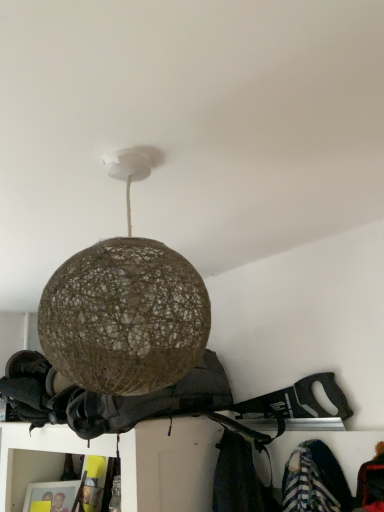
Question: Considering the positions of brown woven sphere at center and brown woven ball at center in the image, is brown woven sphere at center taller or shorter than brown woven ball at center?

Choices:
 (A) short
 (B) tall

Answer: (B)

Question: From the image's perspective, is brown woven sphere at center positioned above or below brown woven ball at center?

Choices:
 (A) below
 (B) above

Answer: (B)

Question: Visually, is brown woven sphere at center positioned to the left or to the right of brown woven ball at center?

Choices:
 (A) left
 (B) right

Answer: (B)

Question: Considering the positions of brown woven ball at center and brown woven sphere at center in the image, is brown woven ball at center bigger or smaller than brown woven sphere at center?

Choices:
 (A) small
 (B) big

Answer: (B)

Question: Is brown woven ball at center taller or shorter than brown woven sphere at center?

Choices:
 (A) short
 (B) tall

Answer: (A)

Question: From the image's perspective, is brown woven ball at center located above or below brown woven sphere at center?

Choices:
 (A) above
 (B) below

Answer: (B)

Question: Do you think brown woven ball at center is within brown woven sphere at center, or outside of it?

Choices:
 (A) outside
 (B) inside

Answer: (A)